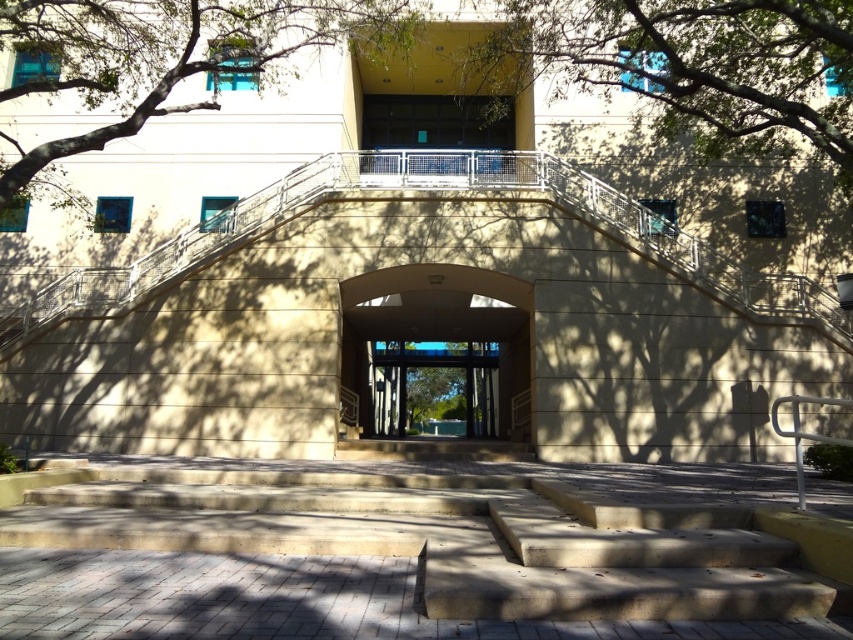
Can you confirm if green leafy tree at upper center is positioned below clear glass doors at center?

No.

Does green leafy tree at upper center appear on the left side of clear glass doors at center?

Incorrect, green leafy tree at upper center is not on the left side of clear glass doors at center.

This screenshot has width=853, height=640. What do you see at coordinates (693, 67) in the screenshot?
I see `green leafy tree at upper center` at bounding box center [693, 67].

Image resolution: width=853 pixels, height=640 pixels. I want to click on green leafy tree at upper center, so click(693, 67).

In order to click on concrete stairs at center in this screenshot , I will do `click(428, 538)`.

Does concrete stairs at center have a greater width compared to clear glass doors at center?

In fact, concrete stairs at center might be narrower than clear glass doors at center.

The image size is (853, 640). What do you see at coordinates (428, 538) in the screenshot?
I see `concrete stairs at center` at bounding box center [428, 538].

I want to click on concrete stairs at center, so click(428, 538).

How distant is green leafy tree at upper left from clear glass doors at center?

They are 14.77 meters apart.

Is point (55, 67) positioned before point (374, 403)?

Yes, it is in front of point (374, 403).

I want to click on green leafy tree at upper left, so click(165, 60).